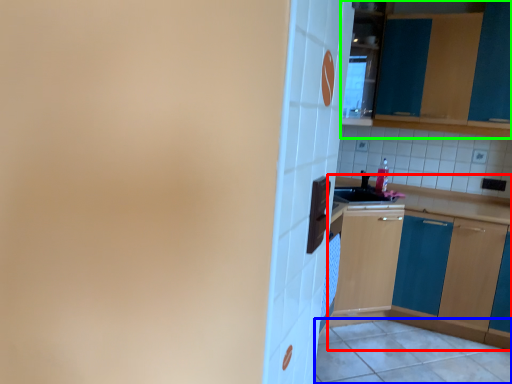
Question: Which object is positioned farthest from cabinetry (highlighted by a red box)? Select from tile (highlighted by a blue box) and cabinetry (highlighted by a green box).

Choices:
 (A) tile
 (B) cabinetry

Answer: (B)